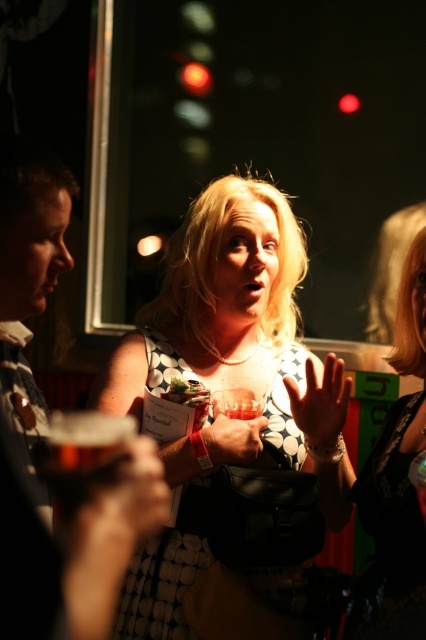
Who is positioned more to the left, white dotted dress at center or smooth skin hand at center?

white dotted dress at center

Where is `white dotted dress at center`? Image resolution: width=426 pixels, height=640 pixels. white dotted dress at center is located at coordinates (167, 570).

I want to click on white dotted dress at center, so click(x=167, y=570).

Is polka dot dress at center wider than matte black purse at center?

Correct, the width of polka dot dress at center exceeds that of matte black purse at center.

Can you confirm if polka dot dress at center is positioned to the right of matte black purse at center?

Incorrect, polka dot dress at center is not on the right side of matte black purse at center.

Between point (218, 365) and point (249, 451), which one is positioned behind?

The point (218, 365) is behind.

At what (x,y) coordinates should I click in order to perform the action: click on polka dot dress at center. Please return your answer as a coordinate pair (x, y). This screenshot has width=426, height=640. Looking at the image, I should click on (241, 333).

Does white dotted dress at center have a smaller size compared to matte black purse at center?

No, white dotted dress at center is not smaller than matte black purse at center.

The height and width of the screenshot is (640, 426). Describe the element at coordinates (167, 570) in the screenshot. I see `white dotted dress at center` at that location.

Who is more distant from viewer, (172,596) or (210,433)?

The point (172,596) is behind.

The width and height of the screenshot is (426, 640). I want to click on white dotted dress at center, so click(167, 570).